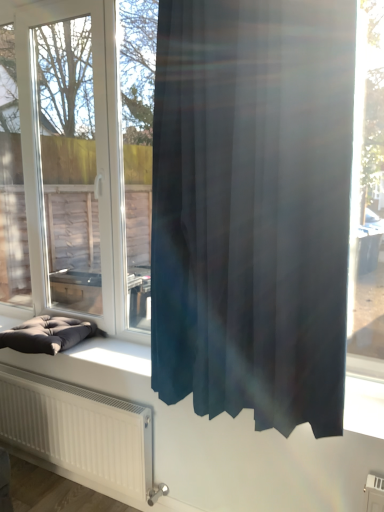
Question: Can you confirm if satin dark blue curtain at center is shorter than dark gray fabric cushion at lower left?

Choices:
 (A) yes
 (B) no

Answer: (B)

Question: Is satin dark blue curtain at center not near dark gray fabric cushion at lower left?

Choices:
 (A) yes
 (B) no

Answer: (A)

Question: From a real-world perspective, is satin dark blue curtain at center on dark gray fabric cushion at lower left?

Choices:
 (A) no
 (B) yes

Answer: (B)

Question: Is satin dark blue curtain at center thinner than dark gray fabric cushion at lower left?

Choices:
 (A) no
 (B) yes

Answer: (B)

Question: From the image's perspective, is satin dark blue curtain at center located beneath dark gray fabric cushion at lower left?

Choices:
 (A) yes
 (B) no

Answer: (B)

Question: From a real-world perspective, is transparent glass window at center above or below satin dark blue curtain at center?

Choices:
 (A) above
 (B) below

Answer: (A)

Question: Relative to satin dark blue curtain at center, is transparent glass window at center in front or behind?

Choices:
 (A) behind
 (B) front

Answer: (A)

Question: Is point (105, 183) closer or farther from the camera than point (301, 419)?

Choices:
 (A) closer
 (B) farther

Answer: (B)

Question: In terms of size, does transparent glass window at center appear bigger or smaller than satin dark blue curtain at center?

Choices:
 (A) small
 (B) big

Answer: (B)

Question: Is point (201, 400) positioned closer to the camera than point (104, 126)?

Choices:
 (A) farther
 (B) closer

Answer: (B)

Question: Is satin dark blue curtain at center bigger or smaller than transparent glass window at center?

Choices:
 (A) big
 (B) small

Answer: (B)

Question: Is satin dark blue curtain at center in front of or behind transparent glass window at center in the image?

Choices:
 (A) front
 (B) behind

Answer: (A)

Question: From a real-world perspective, relative to transparent glass window at center, is satin dark blue curtain at center vertically above or below?

Choices:
 (A) above
 (B) below

Answer: (B)

Question: From the image's perspective, is dark gray fabric cushion at lower left above or below satin dark blue curtain at center?

Choices:
 (A) below
 (B) above

Answer: (A)

Question: In terms of width, does dark gray fabric cushion at lower left look wider or thinner when compared to satin dark blue curtain at center?

Choices:
 (A) thin
 (B) wide

Answer: (B)